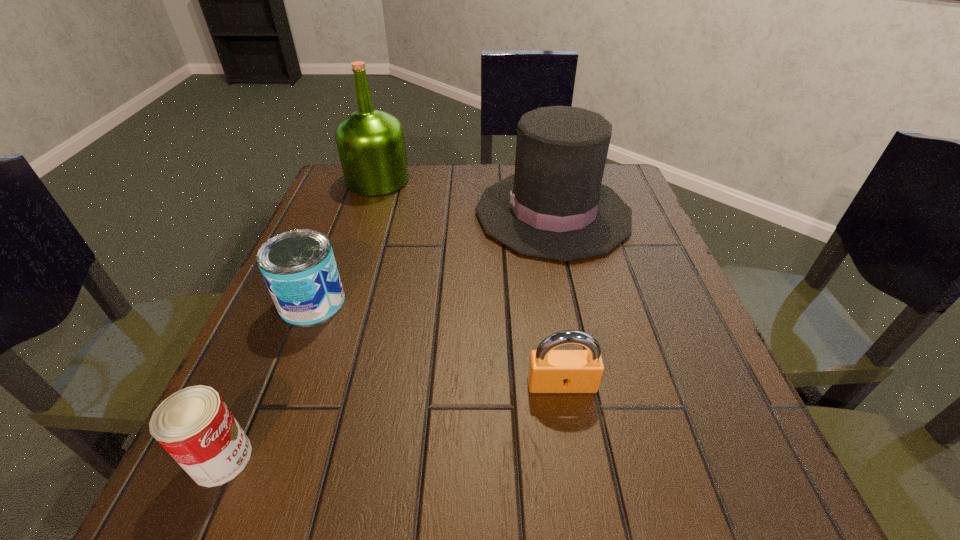
Where is `olive oil`? Image resolution: width=960 pixels, height=540 pixels. olive oil is located at coordinates (371, 145).

In order to click on dress hat in this screenshot , I will do `click(554, 206)`.

I want to click on the farther can, so click(x=298, y=266).

This screenshot has width=960, height=540. In order to click on padlock in this screenshot , I will do `click(549, 371)`.

Where is `the nearest object`? the nearest object is located at coordinates (194, 425).

I want to click on vacant region located 0.280m on the front of the tallest object, so click(x=345, y=276).

Locate an element on the screen. This screenshot has height=540, width=960. vacant space situated on the front of the dress hat with the decoration is located at coordinates tap(444, 213).

In order to click on vacant space located on the front of the dress hat with the decoration in this screenshot , I will do `click(354, 213)`.

At what (x,y) coordinates should I click in order to perform the action: click on vacant area situated on the front of the dress hat with the decoration. Please return your answer as a coordinate pair (x, y). The height and width of the screenshot is (540, 960). Looking at the image, I should click on (319, 213).

Identify the location of free space located on the right of the farther can. (458, 302).